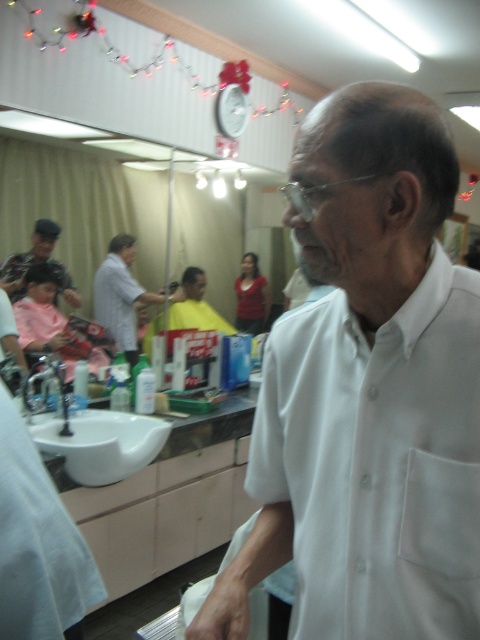
You are a customer in the barbershop and want to know where the matte black hair at left is located. Can you describe its position using coordinates?

The matte black hair at left is located at coordinates point (36, 262).

From the picture: You are a customer in the barbershop and want to know where your glasses are. You remember placing them on a light gray shirt at center. Can you confirm if the point at coordinates (122, 296) is on the light gray shirt at center?

Yes, the point at coordinates (122, 296) is on the light gray shirt at center, so your glasses are likely there.